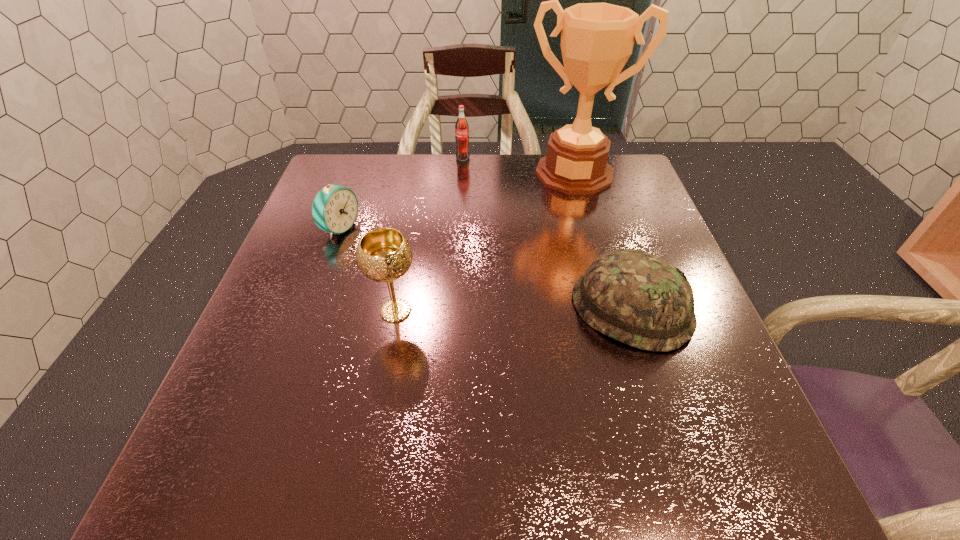
Where is `unoccupied position between the fourth object from right to left and the tallest object`? unoccupied position between the fourth object from right to left and the tallest object is located at coordinates pos(485,242).

Locate an element on the screen. blank region between the award and the third tallest object is located at coordinates (518, 166).

The height and width of the screenshot is (540, 960). Identify the location of vacant space in between the tallest object and the second object from left to right. (485, 242).

Identify the location of free spot between the headwear and the third farthest object. (486, 269).

Locate an element on the screen. This screenshot has height=540, width=960. free spot between the tallest object and the leftmost object is located at coordinates (457, 201).

Locate an element on the screen. The image size is (960, 540). free space between the headwear and the tallest object is located at coordinates (603, 241).

The width and height of the screenshot is (960, 540). Find the location of `vacant space in between the soda bottle and the award`. vacant space in between the soda bottle and the award is located at coordinates (518, 166).

Point out which object is positioned as the nearest to the chalice. Please provide its 2D coordinates. Your answer should be formatted as a tuple, i.e. [(x, y)], where the tuple contains the x and y coordinates of a point satisfying the conditions above.

[(335, 207)]

Identify which object is the third nearest to the chalice. Please provide its 2D coordinates. Your answer should be formatted as a tuple, i.e. [(x, y)], where the tuple contains the x and y coordinates of a point satisfying the conditions above.

[(597, 39)]

Where is `free space that satisfies the following two spatial constraints: 1. on the front side of the award; 2. on the right side of the third object from right to left`? The image size is (960, 540). free space that satisfies the following two spatial constraints: 1. on the front side of the award; 2. on the right side of the third object from right to left is located at coordinates (462, 173).